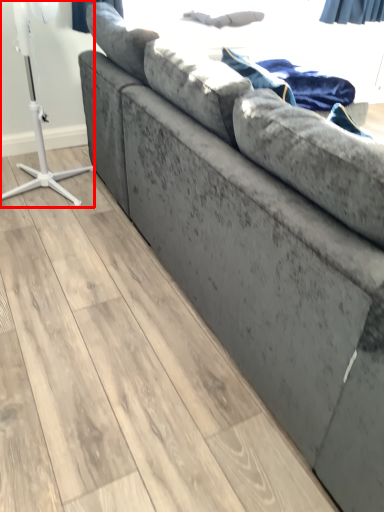
Question: Where is table lamp (annotated by the red box) located in relation to blanket in the image?

Choices:
 (A) left
 (B) right

Answer: (A)